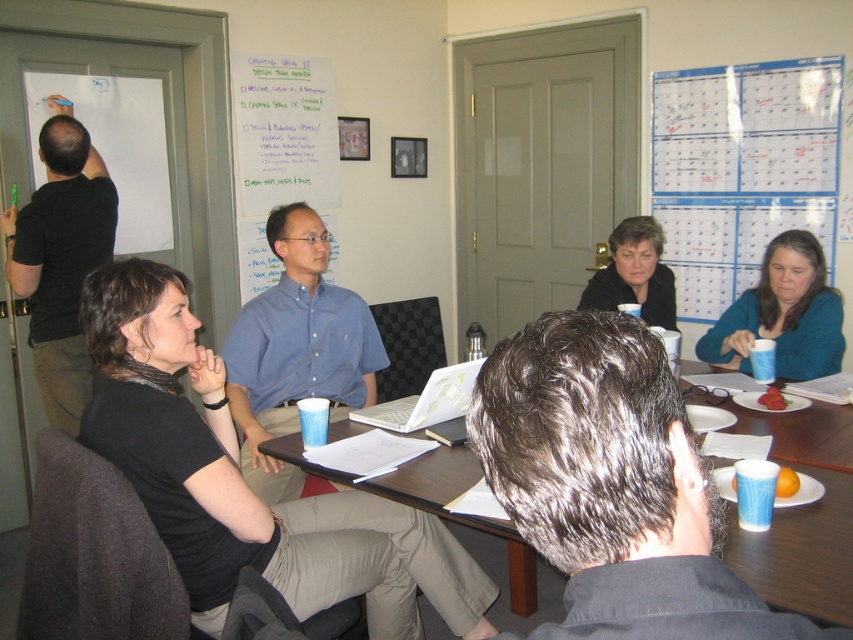
You are a participant in the meeting and need to locate your blue paper cup at lower center. According to the coordinates provided, where exactly should you look on the image to find it?

The blue paper cup at lower center is located at the coordinate point of (801,516).

You are organizing a meeting in this room and need to place a 10 cm tall document holder on the table. Considering the white paper calendar at upper right and the blue paper cup at lower center, which object should you place the document holder next to to ensure it has enough vertical space?

The white paper calendar at upper right is taller than the blue paper cup at lower center, so placing the document holder next to the white paper calendar at upper right would provide sufficient vertical space.

What object is located at the coordinates point (741, 170) in the scene?

The point (741, 170) corresponds to the white paper calendar at upper right.